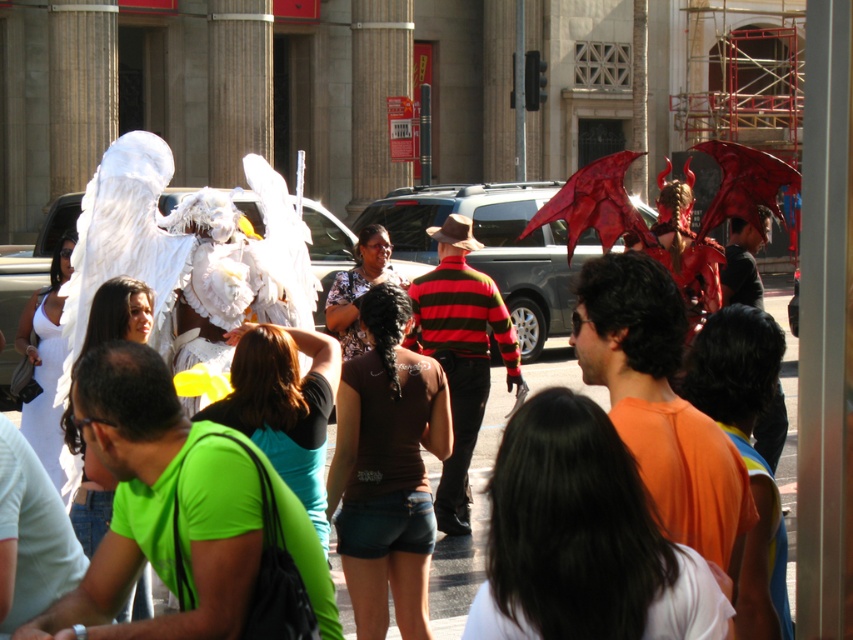
Which is in front, point (520, 637) or point (366, 349)?

Point (520, 637)

Between white matte wings at upper left and brown fabric shirt at center, which one has more height?

brown fabric shirt at center is taller.

Between point (485, 580) and point (329, 305), which one is positioned behind?

The point (329, 305) is more distant.

Find the location of a particular element. white matte wings at upper left is located at coordinates (688, 604).

Does white matte wings at upper left have a lesser height compared to white satin dress at lower left?

Yes.

What do you see at coordinates (688, 604) in the screenshot?
I see `white matte wings at upper left` at bounding box center [688, 604].

This screenshot has width=853, height=640. Identify the location of white matte wings at upper left. (688, 604).

Can you confirm if white satin dress at lower left is thinner than brown fabric shirt at center?

Incorrect, white satin dress at lower left's width is not less than brown fabric shirt at center's.

Which is above, white satin dress at lower left or brown fabric shirt at center?

brown fabric shirt at center

Is point (51, 442) behind point (345, 346)?

No.

I want to click on white satin dress at lower left, so click(49, 404).